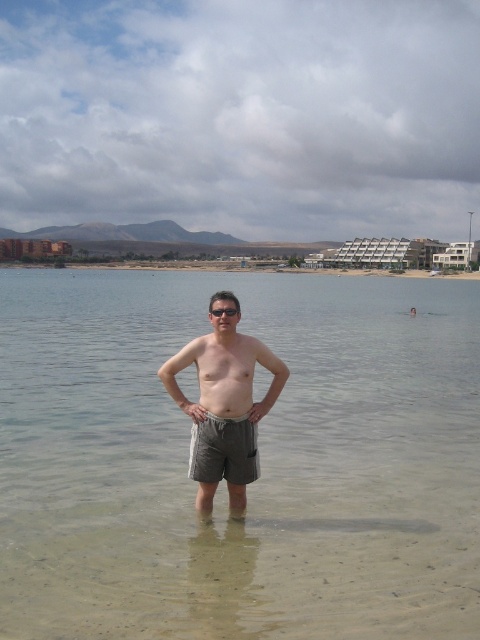
You are a photographer trying to capture a closeup shot of both the khaki shorts at center and the gray cotton shorts at center. Given that your camera can only focus on objects within a 5 inch range, will you be able to capture both in focus?

The distance between the khaki shorts at center and gray cotton shorts at center is 5.32 inches, which exceeds the camera focus range of 5 inches. Therefore, you cannot capture both in focus simultaneously.

In the scene shown: You are a fashion stylist analyzing the beach scene. The person is wearing two pairs of shorts, khaki shorts at center and gray cotton shorts at center. Which pair is located to the left?

The khaki shorts at center is positioned on the left side of gray cotton shorts at center, so the khaki shorts at center is the one on the left.